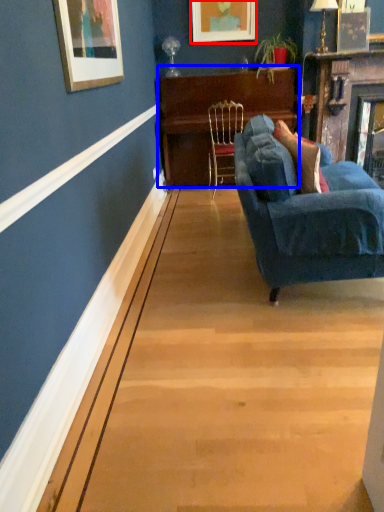
Question: Which object is closer to the camera taking this photo, picture frame (highlighted by a red box) or table (highlighted by a blue box)?

Choices:
 (A) picture frame
 (B) table

Answer: (B)